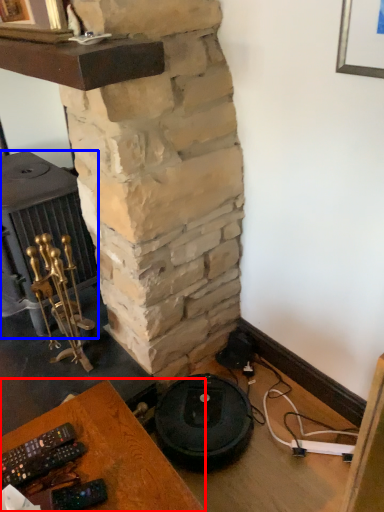
Question: Which of the following is the closest to the observer, furniture (highlighted by a red box) or stove (highlighted by a blue box)?

Choices:
 (A) furniture
 (B) stove

Answer: (A)